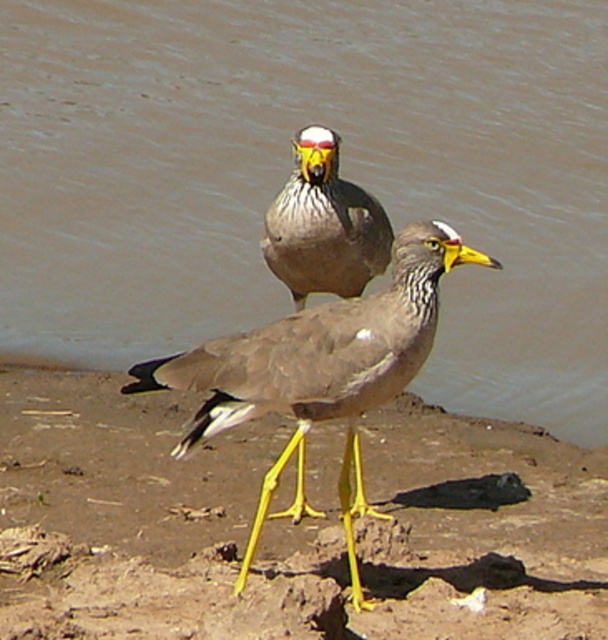
Between brown water at center and matte gray bird at center, which one is positioned higher?

Positioned higher is brown water at center.

Locate an element on the screen. The height and width of the screenshot is (640, 608). brown water at center is located at coordinates (288, 170).

Does point (16, 321) come closer to viewer compared to point (306, 168)?

No, it is behind (306, 168).

Find the location of a particular element. brown water at center is located at coordinates (288, 170).

Which is below, brown water at center or yellowish-brown mud at center?

yellowish-brown mud at center is lower down.

Who is more forward, (230,164) or (76,477)?

Positioned in front is point (76,477).

Which is behind, point (139, 125) or point (30, 492)?

The point (139, 125) is more distant.

The height and width of the screenshot is (640, 608). Identify the location of brown water at center. (288, 170).

Can you confirm if yellowish-brown mud at center is positioned to the left of matte gray bird at center?

No, yellowish-brown mud at center is not to the left of matte gray bird at center.

Is yellowish-brown mud at center to the right of matte gray bird at center from the viewer's perspective?

Correct, you'll find yellowish-brown mud at center to the right of matte gray bird at center.

Where is `yellowish-brown mud at center`? The height and width of the screenshot is (640, 608). yellowish-brown mud at center is located at coordinates (286, 524).